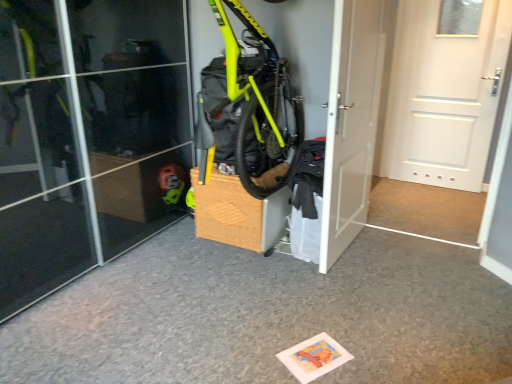
Question: Is white matte door at center, the first door when ordered from left to right, located outside white matte door at right, which is the second door from left to right?

Choices:
 (A) no
 (B) yes

Answer: (B)

Question: Is white matte door at right, the 1th door when ordered from right to left, a part of white matte door at center, arranged as the 2th door when viewed from the right?

Choices:
 (A) yes
 (B) no

Answer: (B)

Question: From a real-world perspective, does white matte door at center, arranged as the 2th door when viewed from the right, stand above white matte door at right, which is the second door from left to right?

Choices:
 (A) yes
 (B) no

Answer: (B)

Question: From the image's perspective, would you say white matte door at center, arranged as the 2th door when viewed from the right, is positioned over white matte door at right, the 1th door when ordered from right to left?

Choices:
 (A) no
 (B) yes

Answer: (A)

Question: Considering the relative sizes of white matte door at center, arranged as the 2th door when viewed from the right, and white matte door at right, which is the second door from left to right, in the image provided, is white matte door at center, arranged as the 2th door when viewed from the right, smaller than white matte door at right, which is the second door from left to right,?

Choices:
 (A) no
 (B) yes

Answer: (B)

Question: From the image's perspective, is white matte door at center, arranged as the 2th door when viewed from the right, below white matte door at right, which is the second door from left to right?

Choices:
 (A) no
 (B) yes

Answer: (B)

Question: Considering the relative positions of white matte door at right, the 1th door when ordered from right to left, and white matte door at center, the first door when ordered from left to right, in the image provided, is white matte door at right, the 1th door when ordered from right to left, to the left of white matte door at center, the first door when ordered from left to right, from the viewer's perspective?

Choices:
 (A) no
 (B) yes

Answer: (A)

Question: Could white matte door at center, the first door when ordered from left to right, be considered to be inside white matte door at right, which is the second door from left to right?

Choices:
 (A) yes
 (B) no

Answer: (B)

Question: From a real-world perspective, is white matte door at right, which is the second door from left to right, under white matte door at center, arranged as the 2th door when viewed from the right?

Choices:
 (A) yes
 (B) no

Answer: (B)

Question: Is white matte door at right, the 1th door when ordered from right to left, not inside white matte door at center, arranged as the 2th door when viewed from the right?

Choices:
 (A) yes
 (B) no

Answer: (A)

Question: Does white matte door at right, which is the second door from left to right, have a greater width compared to white matte door at center, arranged as the 2th door when viewed from the right?

Choices:
 (A) no
 (B) yes

Answer: (B)

Question: Does white matte door at right, which is the second door from left to right, have a smaller size compared to white matte door at center, the first door when ordered from left to right?

Choices:
 (A) no
 (B) yes

Answer: (A)

Question: Looking at the image, does white matte door at right, which is the second door from left to right, seem bigger or smaller compared to white matte door at center, the first door when ordered from left to right?

Choices:
 (A) small
 (B) big

Answer: (B)